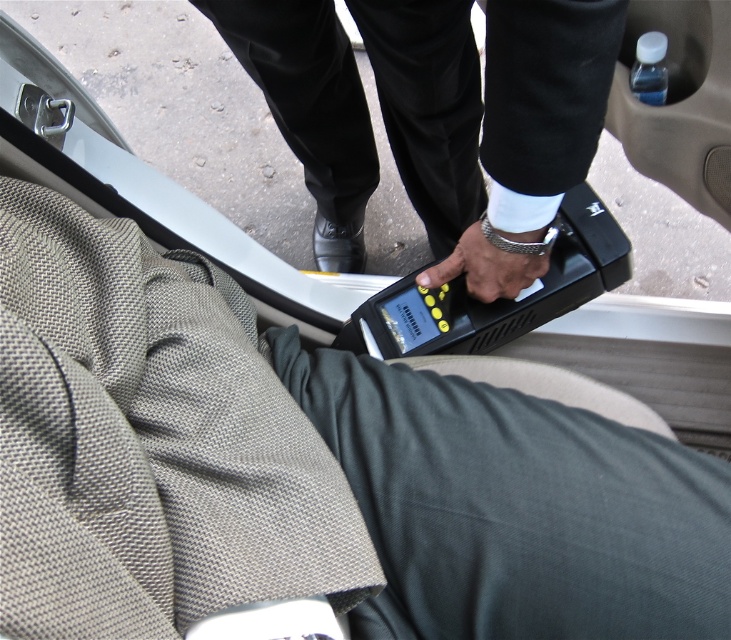
Does black plastic remote at center appear on the left side of satin silver wristwatch at center?

Correct, you'll find black plastic remote at center to the left of satin silver wristwatch at center.

Is point (504, 163) behind point (507, 259)?

No, (504, 163) is in front of (507, 259).

Find the location of a particular element. Image resolution: width=731 pixels, height=640 pixels. black plastic remote at center is located at coordinates (491, 116).